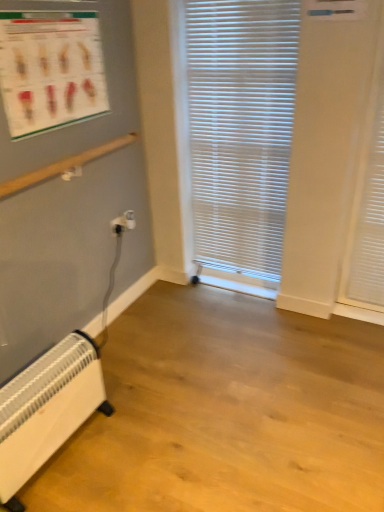
At what (x,y) coordinates should I click in order to perform the action: click on free region under white plastic heater at lower left (from a real-world perspective). Please return your answer as a coordinate pair (x, y). Looking at the image, I should click on (66, 454).